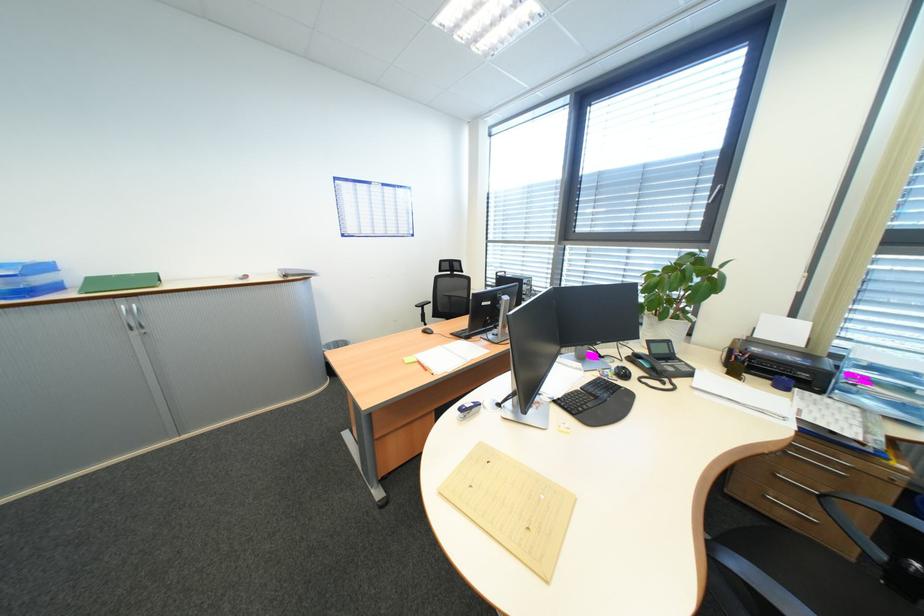
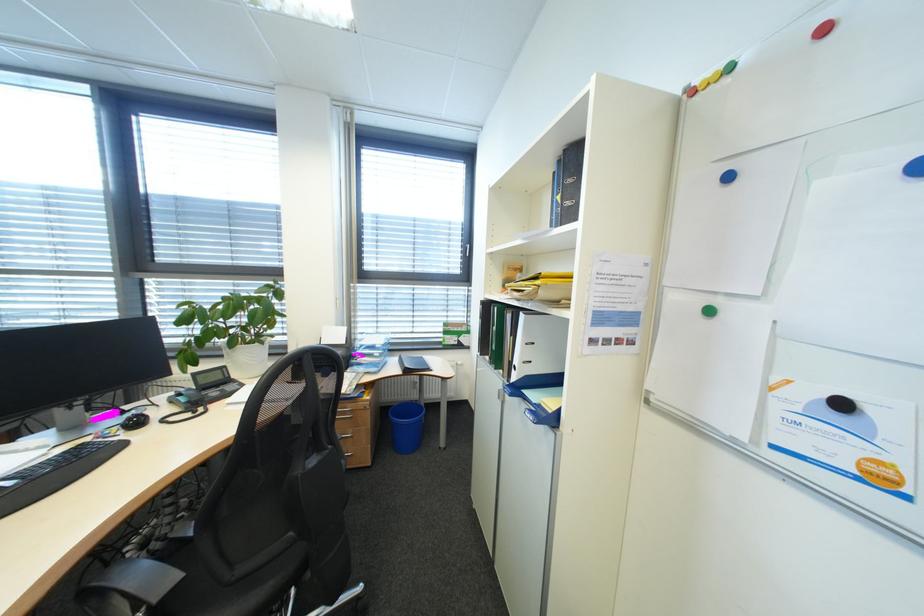
Where in the second image is the point corresponding to (813,347) from the first image?

(355, 344)